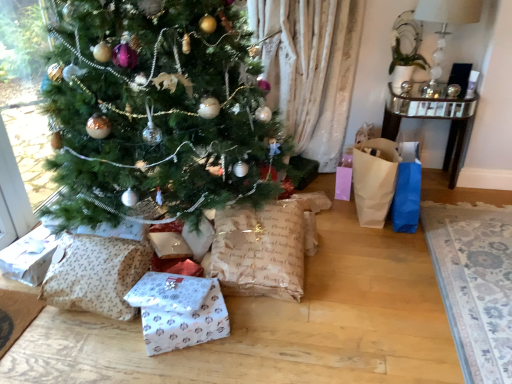
Question: In terms of size, does white fabric lampshade at upper right appear bigger or smaller than patterned paper sack at lower left, the 2th sack in the right-to-left sequence?

Choices:
 (A) small
 (B) big

Answer: (B)

Question: Considering the positions of white fabric lampshade at upper right and patterned paper sack at lower left, the 2th sack in the right-to-left sequence, in the image, is white fabric lampshade at upper right wider or thinner than patterned paper sack at lower left, the 2th sack in the right-to-left sequence,?

Choices:
 (A) wide
 (B) thin

Answer: (A)

Question: Considering the real-world distances, which object is farthest from the white paper gift at lower center?

Choices:
 (A) patterned paper sack at lower left, the first sack when ordered from left to right
 (B) green matte christmas tree at center
 (C) white fabric lampshade at upper right
 (D) burlap paper sack at lower center, the second sack in the left-to-right sequence
 (E) brown paper bag at right

Answer: (C)

Question: Estimate the real-world distances between objects in this image. Which object is farther from the green matte christmas tree at center?

Choices:
 (A) white paper gift at lower center
 (B) white fabric lampshade at upper right
 (C) brown paper bag at right
 (D) patterned paper sack at lower left, the 2th sack in the right-to-left sequence
 (E) burlap paper sack at lower center, arranged as the first sack when viewed from the right

Answer: (B)